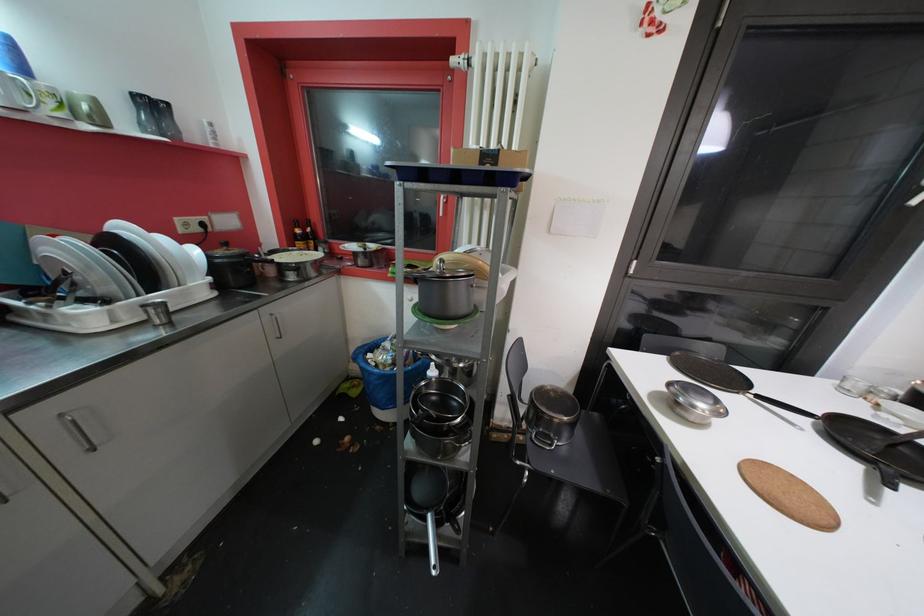
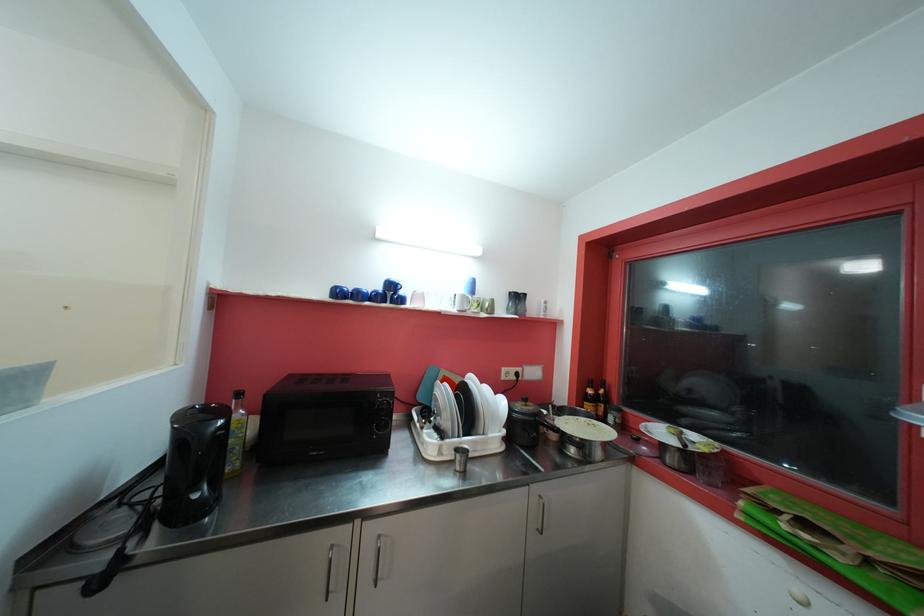
Where in the second image is the point corresponding to pixel 67 418 from the first image?

(383, 539)